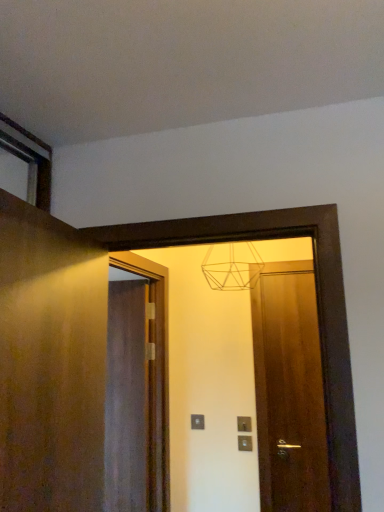
Question: Based on their sizes in the image, would you say matte wooden mirror at center is bigger or smaller than matte brown door at center, the 2th door when ordered from back to front?

Choices:
 (A) small
 (B) big

Answer: (B)

Question: Choose the correct answer: Is matte wooden mirror at center inside matte brown door at center, the 2th door viewed from the front, or outside it?

Choices:
 (A) outside
 (B) inside

Answer: (A)

Question: Based on their relative distances, which object is nearer to the wooden door at left, which is the first door from front to back?

Choices:
 (A) satin silver switch at center, arranged as the second electric outlet when viewed from the back
 (B) wooden door at center, the 1th door viewed from the back
 (C) matte gray electric outlet at center, which is the first electric outlet in back-to-front order
 (D) matte brown door at center, positioned as the third door in left-to-right order
 (E) matte wooden mirror at center

Answer: (B)

Question: Estimate the real-world distances between objects in this image. Which object is closer to the matte brown door at center, positioned as the third door in left-to-right order?

Choices:
 (A) matte wooden mirror at center
 (B) wooden door at left, which is the first door from front to back
 (C) matte gray electric outlet at center, which is the first electric outlet in back-to-front order
 (D) satin silver switch at center, which is counted as the 1th electric outlet, starting from the front
 (E) wooden door at center, which is the 2th door in left-to-right order

Answer: (A)